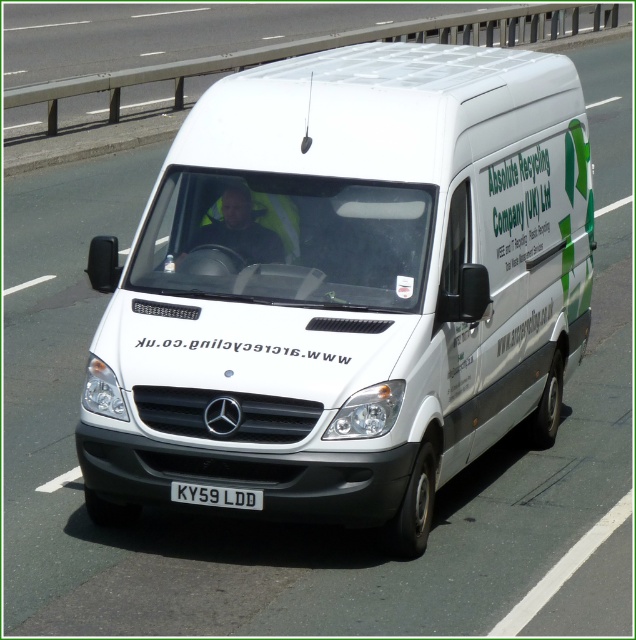
Question: Does white matte van at center appear under reflective yellow vest at center?

Choices:
 (A) yes
 (B) no

Answer: (A)

Question: Among these points, which one is farthest from the camera?

Choices:
 (A) (238, 188)
 (B) (219, 493)

Answer: (A)

Question: Can you confirm if reflective yellow vest at center is smaller than white plastic license plate at center?

Choices:
 (A) yes
 (B) no

Answer: (B)

Question: Estimate the real-world distances between objects in this image. Which object is closer to the reflective yellow vest at center?

Choices:
 (A) white plastic license plate at center
 (B) white matte van at center

Answer: (B)

Question: Is white matte van at center to the left of white plastic license plate at center from the viewer's perspective?

Choices:
 (A) yes
 (B) no

Answer: (B)

Question: Which object appears closest to the camera in this image?

Choices:
 (A) white plastic license plate at center
 (B) reflective yellow vest at center

Answer: (A)